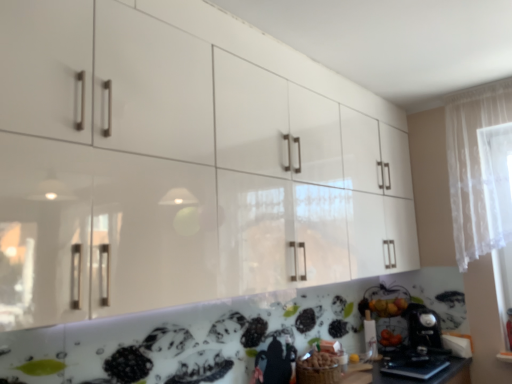
Locate an element on the screen. This screenshot has height=384, width=512. black plastic coffee machine at lower right is located at coordinates (424, 332).

Describe the element at coordinates (424, 332) in the screenshot. The width and height of the screenshot is (512, 384). I see `black plastic coffee machine at lower right` at that location.

Locate an element on the screen. black plastic coffee machine at lower right is located at coordinates (424, 332).